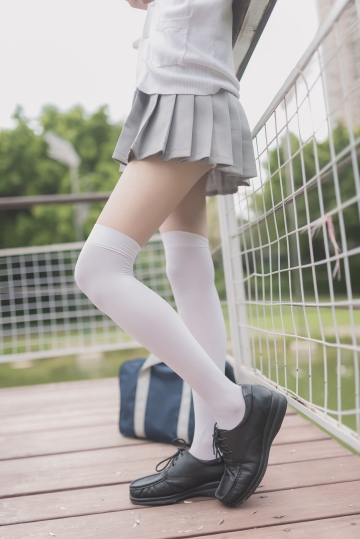
Identify the location of floor. (103, 486).